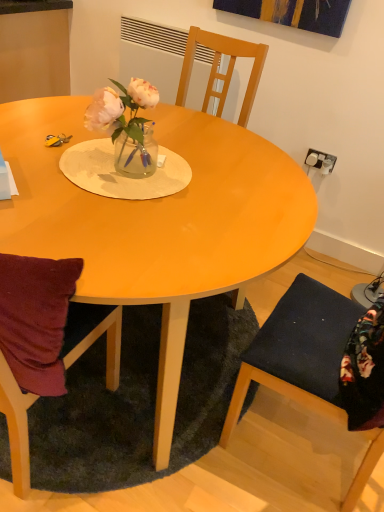
Question: Considering the positions of point (359, 480) and point (77, 193), is point (359, 480) closer or farther from the camera than point (77, 193)?

Choices:
 (A) closer
 (B) farther

Answer: (B)

Question: Choose the correct answer: Is dark blue fabric chair at lower right inside matte wood table at center or outside it?

Choices:
 (A) inside
 (B) outside

Answer: (B)

Question: Based on their relative distances, which object is farther from the dark green shaggy rug at lower center?

Choices:
 (A) translucent glass vase at center
 (B) matte wood table at center
 (C) dark blue fabric chair at lower right

Answer: (A)

Question: Estimate the real-world distances between objects in this image. Which object is farther from the dark blue fabric chair at lower right?

Choices:
 (A) matte wood table at center
 (B) translucent glass vase at center
 (C) dark green shaggy rug at lower center

Answer: (B)